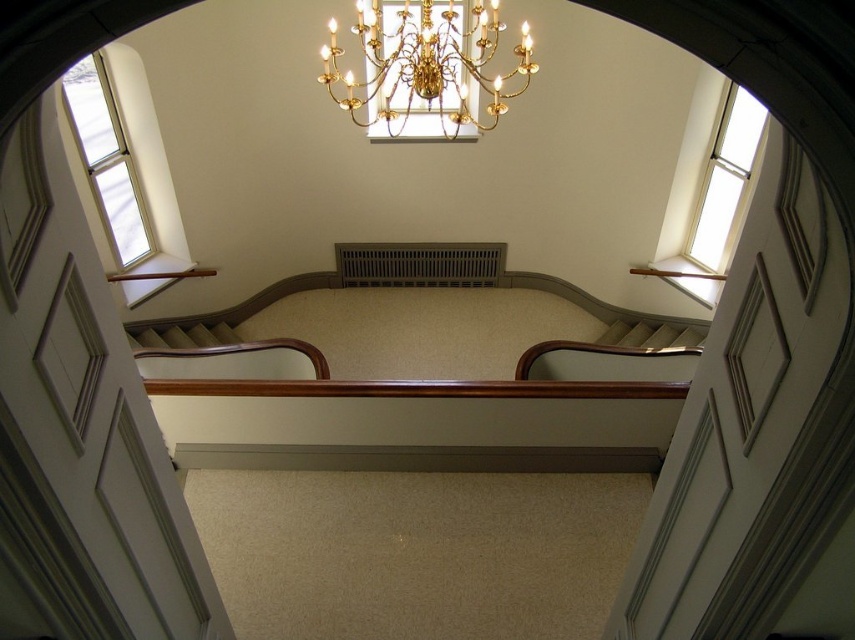
You are standing at the bottom of the staircase and looking up. Which object is located above the other between the clear glass window at upper right and the wooden balustrade at center?

The clear glass window at upper right is positioned over the wooden balustrade at center.

You are an interior designer assessing the space for a new artwork installation. You have two options for placement locations near the staircase. The first option is next to the white glass window at upper left, and the second is near the wooden balustrade at center. Considering their sizes, which location would allow for a larger artwork without overcrowding the area?

The white glass window at upper left is bigger than the wooden balustrade at center, so placing the artwork next to the white glass window at upper left would allow for a larger piece without overcrowding the area.

You are standing in the doorway looking up at the staircase and the gold metallic chandelier at upper center. If you were to draw a straight line from your eye level to the chandelier, would it intersect the staircase? Please answer based on the coordinates provided in the scene description.

The gold metallic chandelier at upper center is located at coordinates approximately 0.102 on the x and 0.498 on the y. Since the staircase is positioned below the chandelier and the line from your eye level would go directly upwards towards the chandelier, it would not intersect the staircase.